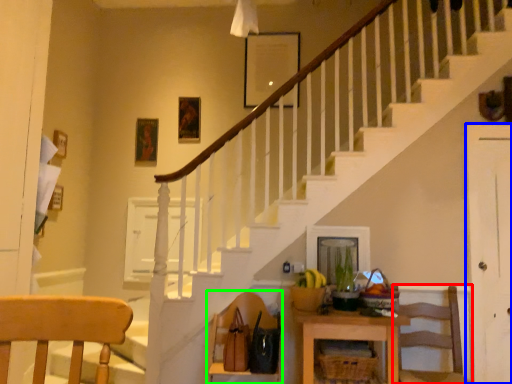
Question: Estimate the real-world distances between objects in this image. Which object is farther from chair (highlighted by a red box), door (highlighted by a blue box) or chair (highlighted by a green box)?

Choices:
 (A) door
 (B) chair

Answer: (B)